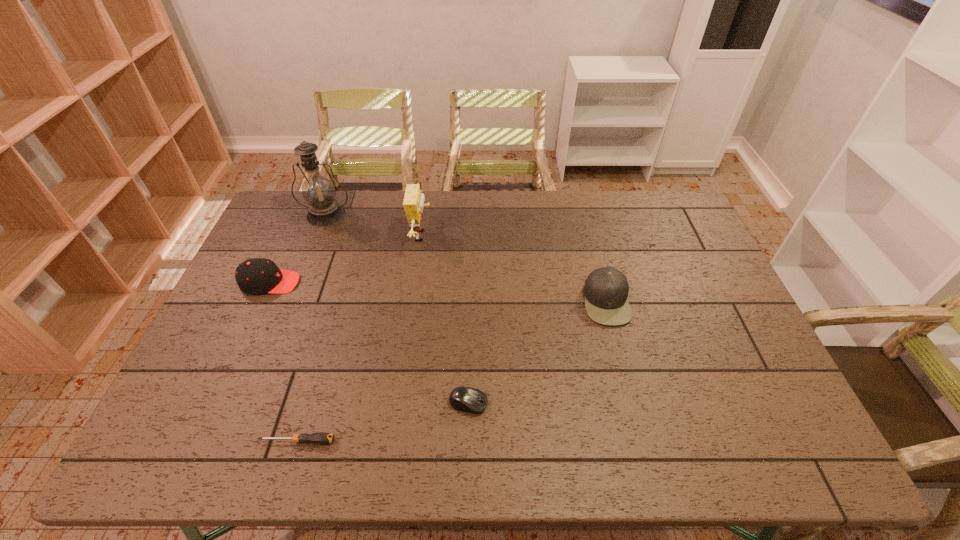
The height and width of the screenshot is (540, 960). I want to click on the tallest object, so click(318, 191).

The width and height of the screenshot is (960, 540). What are the coordinates of `the third object from right to left` in the screenshot? It's located at (413, 203).

Where is `the second tallest object`? The width and height of the screenshot is (960, 540). the second tallest object is located at coordinates (413, 203).

You are a GUI agent. You are given a task and a screenshot of the screen. Output one action in this format:
    pyautogui.click(x=<x>, y=<y>)
    Task: Click on the right cap
    Image resolution: width=960 pixels, height=540 pixels.
    Given the screenshot: What is the action you would take?
    pyautogui.click(x=606, y=289)

At what (x,y) coordinates should I click in order to perform the action: click on the left cap. Please return your answer as a coordinate pair (x, y). Looking at the image, I should click on (254, 276).

Find the location of a particular element. Image resolution: width=960 pixels, height=540 pixels. mouse is located at coordinates (466, 399).

You are a GUI agent. You are given a task and a screenshot of the screen. Output one action in this format:
    pyautogui.click(x=<x>, y=<y>)
    Task: Click on the fifth tallest object
    Image resolution: width=960 pixels, height=540 pixels.
    Given the screenshot: What is the action you would take?
    pyautogui.click(x=466, y=399)

Identify the location of the nearest object. (321, 438).

Image resolution: width=960 pixels, height=540 pixels. What are the coordinates of `the shortest object` in the screenshot? It's located at (321, 438).

The width and height of the screenshot is (960, 540). In order to click on free region located 0.180m on the front of the oil lamp in this screenshot , I will do `click(307, 262)`.